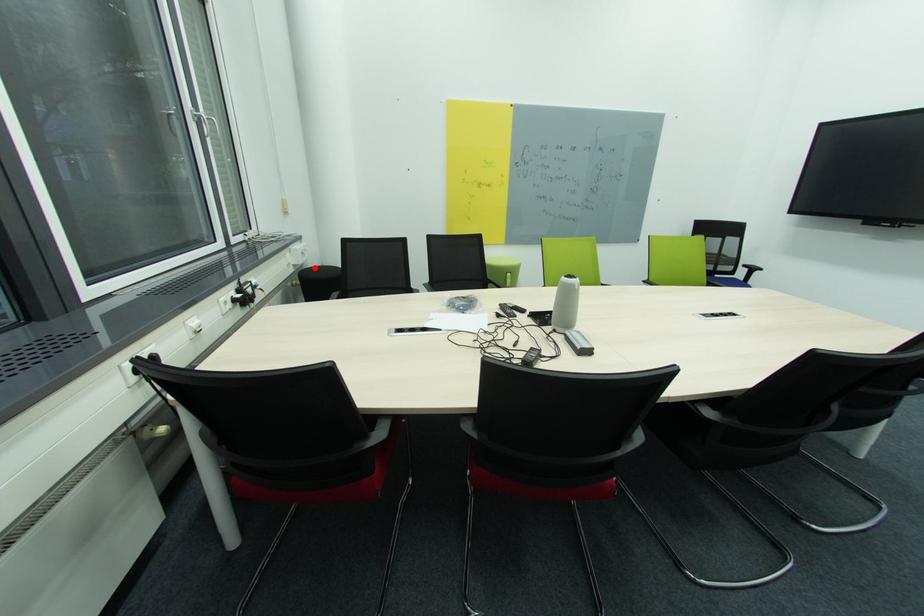
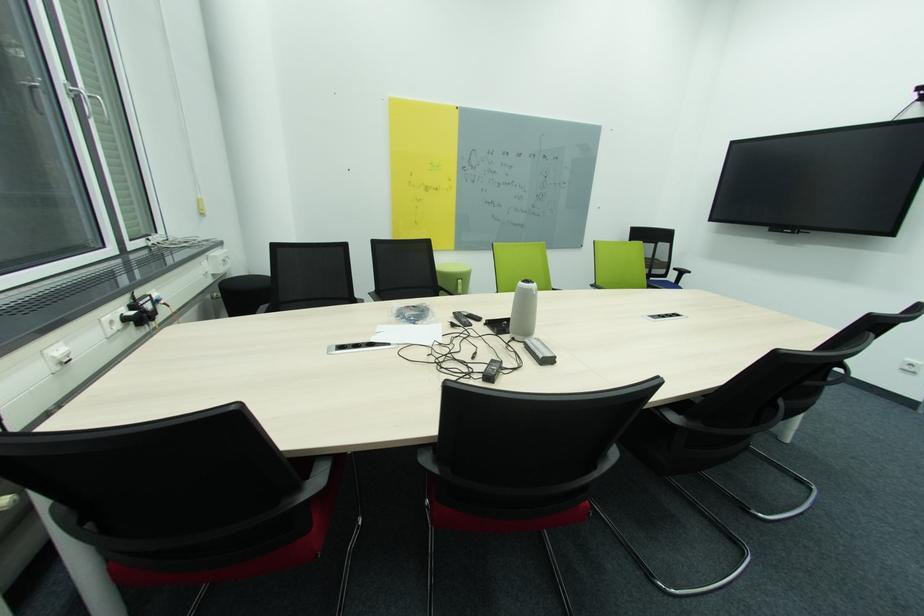
Find the pixel in the second image that matches the highlighted location in the first image.

(238, 278)